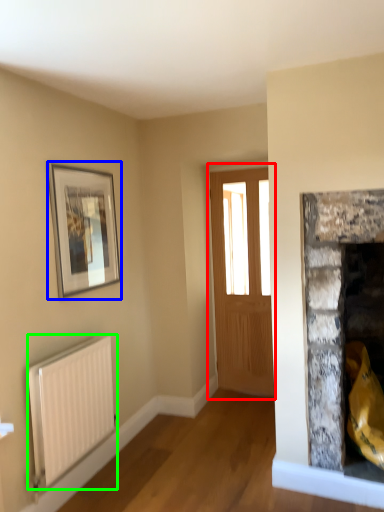
Question: Based on their relative distances, which object is farther from window (highlighted by a red box)? Choose from picture frame (highlighted by a blue box) and radiator (highlighted by a green box).

Choices:
 (A) picture frame
 (B) radiator

Answer: (B)